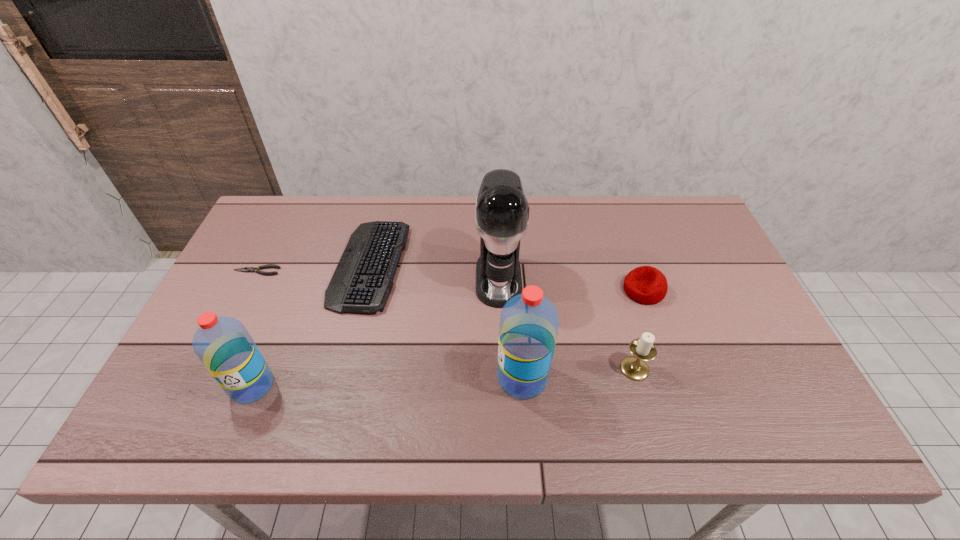
This screenshot has width=960, height=540. Identify the location of object located in the far edge section of the desktop. (363, 279).

In order to click on candle holder located in the near edge section of the desktop in this screenshot , I will do `click(634, 367)`.

Locate an element on the screen. The image size is (960, 540). water bottle positioned at the left edge is located at coordinates (223, 344).

I want to click on pliers located in the left edge section of the desktop, so click(246, 269).

Identify the location of object present at the near left corner. (223, 344).

In the image, there is a desktop. In order to click on vacant space at the far edge in this screenshot , I will do `click(554, 212)`.

This screenshot has width=960, height=540. Identify the location of free location at the near edge of the desktop. (391, 380).

Identify the location of vacant space at the left edge of the desktop. This screenshot has height=540, width=960. (244, 284).

Image resolution: width=960 pixels, height=540 pixels. I want to click on vacant space at the right edge of the desktop, so click(x=684, y=248).

Where is `vacant area at the far left corner`? The height and width of the screenshot is (540, 960). vacant area at the far left corner is located at coordinates (303, 230).